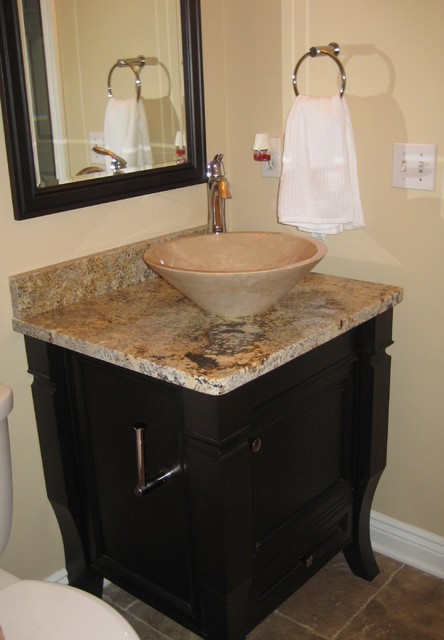
This screenshot has width=444, height=640. I want to click on toilet bowl, so click(x=12, y=482).